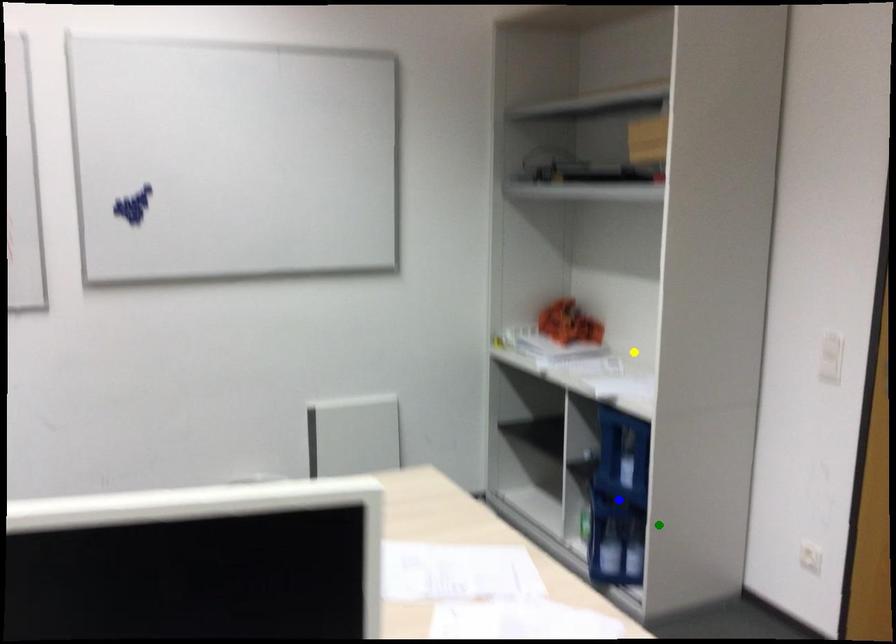
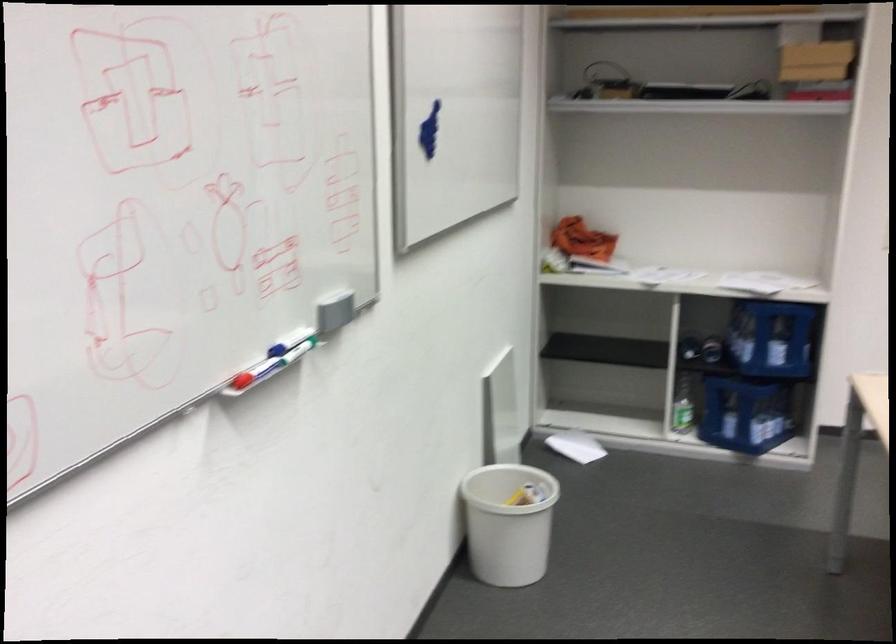
I am providing you with two images of the same scene from different viewpoints. Three points are marked in image1. Which point corresponds to a part or object that is occluded in image2?In image1, three points are marked. Which of them correspond to a part or object that is occluded in image2?Among the three points shown in image1, which one corresponds to a part or object that is no longer visible due to occlusion in image2?

blue point cannot be seen in image2.